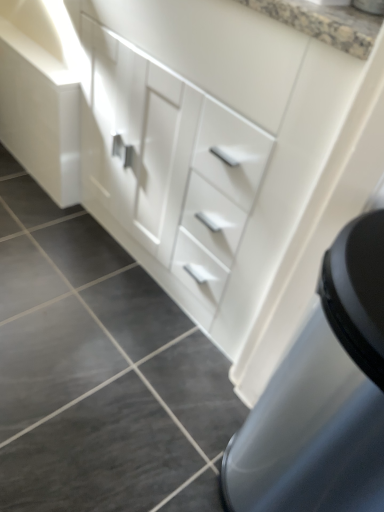
Question: Considering the relative sizes of dark gray tile at lower left and white glossy drawer at center in the image provided, is dark gray tile at lower left wider than white glossy drawer at center?

Choices:
 (A) yes
 (B) no

Answer: (B)

Question: From a real-world perspective, is dark gray tile at lower left positioned under white glossy drawer at center based on gravity?

Choices:
 (A) no
 (B) yes

Answer: (B)

Question: Can you confirm if dark gray tile at lower left is positioned to the right of white glossy drawer at center?

Choices:
 (A) no
 (B) yes

Answer: (A)

Question: Is dark gray tile at lower left facing away from white glossy drawer at center?

Choices:
 (A) yes
 (B) no

Answer: (B)

Question: From the image's perspective, is dark gray tile at lower left located above white glossy drawer at center?

Choices:
 (A) yes
 (B) no

Answer: (B)

Question: Does dark gray tile at lower left have a larger size compared to white glossy drawer at center?

Choices:
 (A) no
 (B) yes

Answer: (A)

Question: From the image's perspective, is white glossy drawer at center on dark gray tile at lower left?

Choices:
 (A) no
 (B) yes

Answer: (B)

Question: From a real-world perspective, is white glossy drawer at center physically above dark gray tile at lower left?

Choices:
 (A) no
 (B) yes

Answer: (B)

Question: Does white glossy drawer at center have a larger size compared to dark gray tile at lower left?

Choices:
 (A) yes
 (B) no

Answer: (A)

Question: Does white glossy drawer at center have a smaller size compared to dark gray tile at lower left?

Choices:
 (A) yes
 (B) no

Answer: (B)

Question: Considering the relative sizes of white glossy drawer at center and dark gray tile at lower left in the image provided, is white glossy drawer at center taller than dark gray tile at lower left?

Choices:
 (A) yes
 (B) no

Answer: (A)

Question: From a real-world perspective, is white glossy drawer at center physically below dark gray tile at lower left?

Choices:
 (A) yes
 (B) no

Answer: (B)

Question: From a real-world perspective, relative to dark gray tile at lower left, is white glossy drawer at center vertically above or below?

Choices:
 (A) below
 (B) above

Answer: (B)